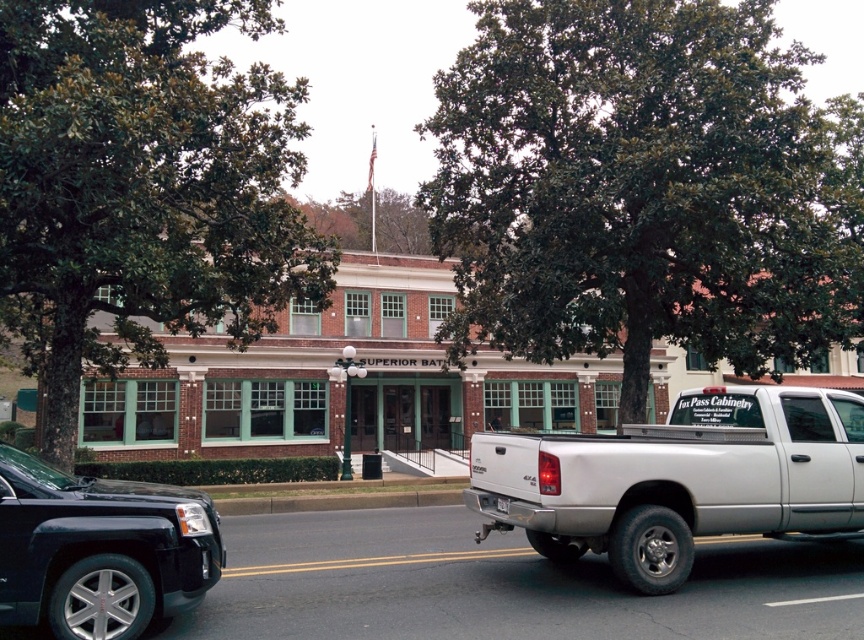
Question: Is green leafy tree at center smaller than white plastic license plate at rear?

Choices:
 (A) yes
 (B) no

Answer: (B)

Question: Which object appears closest to the camera in this image?

Choices:
 (A) green leafy tree at center
 (B) silver metallic truck at right
 (C) white plastic license plate at rear
 (D) shiny black suv at left

Answer: (D)

Question: Which point is farther to the camera?

Choices:
 (A) (507, 508)
 (B) (29, 124)
 (C) (786, 438)
 (D) (700, 40)

Answer: (D)

Question: Observing the image, what is the correct spatial positioning of green leafy tree at upper left in reference to white plastic license plate at rear?

Choices:
 (A) left
 (B) right

Answer: (A)

Question: Can you confirm if green leafy tree at center is bigger than shiny black suv at left?

Choices:
 (A) yes
 (B) no

Answer: (A)

Question: Estimate the real-world distances between objects in this image. Which object is farther from the white plastic license plate at rear?

Choices:
 (A) green leafy tree at upper left
 (B) silver metallic truck at right
 (C) green leafy tree at center

Answer: (C)